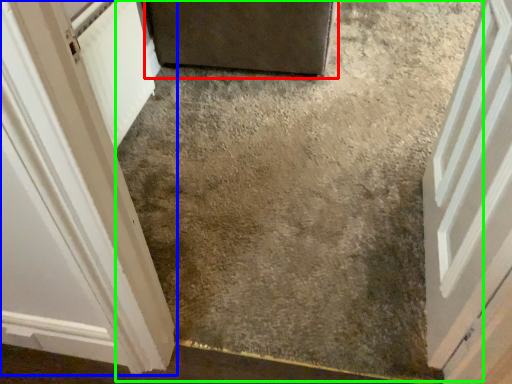
Question: Based on their relative distances, which object is nearer to door (highlighted by a red box)? Choose from door (highlighted by a blue box) and concrete (highlighted by a green box).

Choices:
 (A) door
 (B) concrete

Answer: (B)